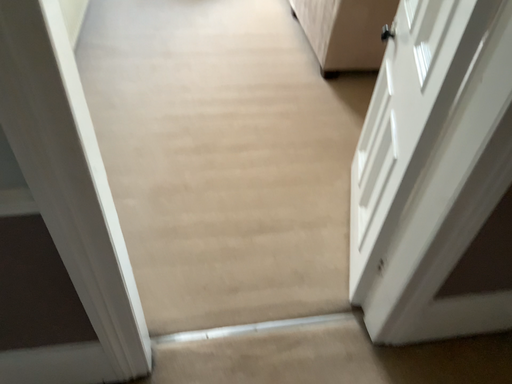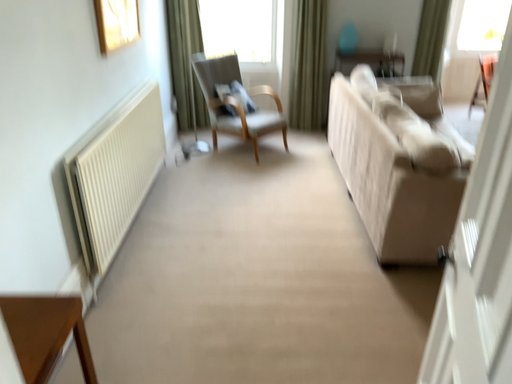
Question: How did the camera likely rotate when shooting the video?

Choices:
 (A) rotated right
 (B) rotated left

Answer: (B)